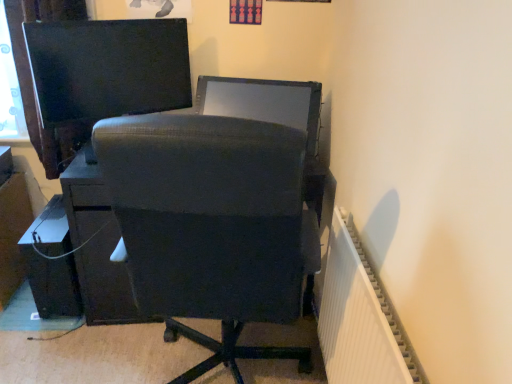
What are the coordinates of `free point in front of matte black cable at lower left` in the screenshot? It's located at pos(55,342).